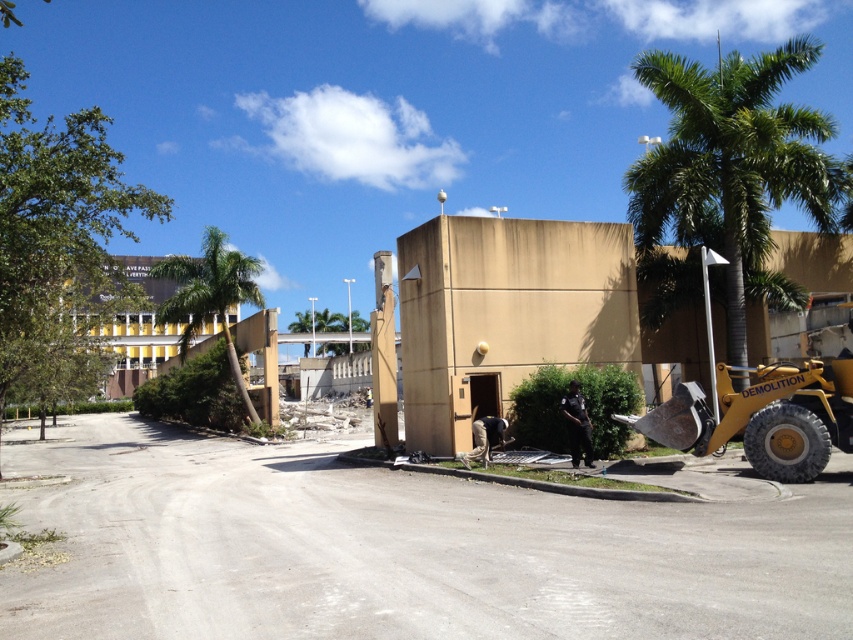
From the picture: Does yellow rubber tire excavator at lower right have a lesser width compared to green leafy palm tree at left?

Indeed, yellow rubber tire excavator at lower right has a lesser width compared to green leafy palm tree at left.

Who is more forward, [815,368] or [149,268]?

Positioned in front is point [815,368].

Where is `yellow rubber tire excavator at lower right`? yellow rubber tire excavator at lower right is located at coordinates (762, 417).

Is green leafy palm tree at upper right thinner than green leafy palm tree at left?

No.

Does green leafy palm tree at upper right have a lesser height compared to green leafy palm tree at left?

In fact, green leafy palm tree at upper right may be taller than green leafy palm tree at left.

Who is more forward, (724,60) or (161,269)?

Point (161,269)

Locate an element on the screen. This screenshot has height=640, width=853. green leafy palm tree at upper right is located at coordinates (732, 161).

Between green leafy palm tree at upper right and yellow rubber tire excavator at lower right, which one appears on the left side from the viewer's perspective?

yellow rubber tire excavator at lower right

Can you confirm if green leafy palm tree at upper right is positioned to the left of yellow rubber tire excavator at lower right?

No, green leafy palm tree at upper right is not to the left of yellow rubber tire excavator at lower right.

Between point (824, 193) and point (781, 452), which one is positioned in front?

Positioned in front is point (781, 452).

The width and height of the screenshot is (853, 640). I want to click on green leafy palm tree at upper right, so click(x=732, y=161).